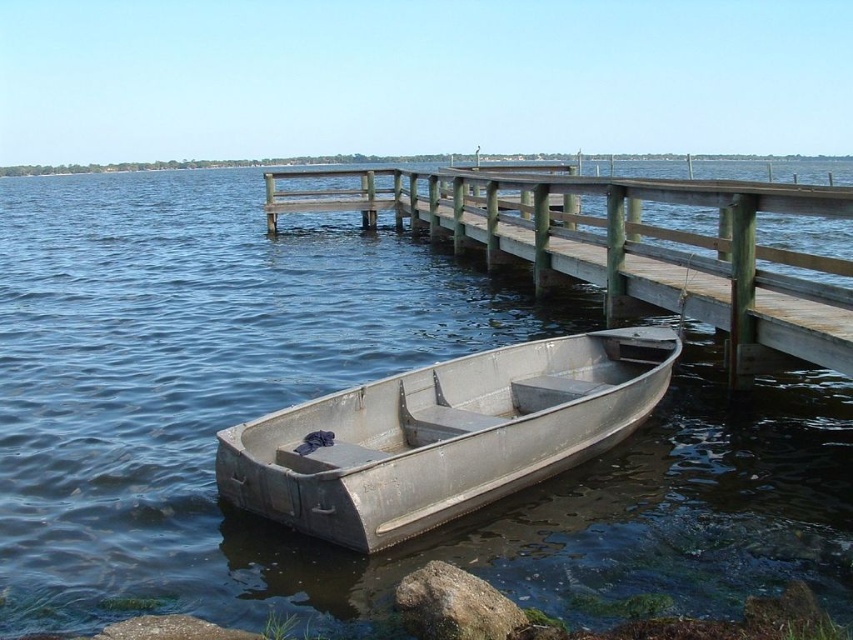
Question: Which point appears closest to the camera in this image?

Choices:
 (A) (213, 173)
 (B) (350, 209)

Answer: (B)

Question: Is metallic water at center further to camera compared to metallic gray boat at lower left?

Choices:
 (A) yes
 (B) no

Answer: (B)

Question: Based on their relative distances, which object is farther from the metallic water at center?

Choices:
 (A) green wood rail at center
 (B) metallic gray boat at lower left

Answer: (B)

Question: Does metallic gray boat at lower left appear on the left side of green wood rail at center?

Choices:
 (A) yes
 (B) no

Answer: (A)

Question: From the image, what is the correct spatial relationship of metallic gray boat at lower left in relation to green wood rail at center?

Choices:
 (A) below
 (B) above

Answer: (A)

Question: Which of the following is the farthest from the observer?

Choices:
 (A) green wood rail at center
 (B) metallic water at center

Answer: (A)